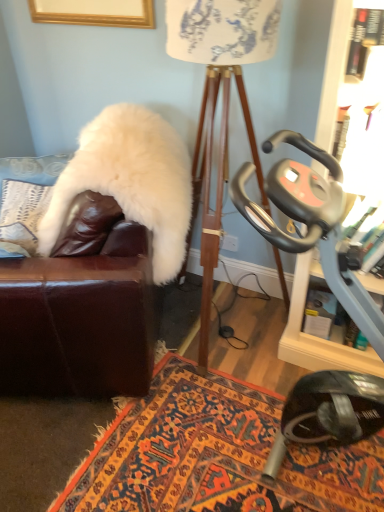
Question: Does white fluffy pillow at upper left come in front of white fabric lampshade at center?

Choices:
 (A) no
 (B) yes

Answer: (A)

Question: Is white fluffy pillow at upper left thinner than white fabric lampshade at center?

Choices:
 (A) yes
 (B) no

Answer: (A)

Question: Considering the relative sizes of white fluffy pillow at upper left and white fabric lampshade at center in the image provided, is white fluffy pillow at upper left wider than white fabric lampshade at center?

Choices:
 (A) no
 (B) yes

Answer: (A)

Question: Considering the relative sizes of white fluffy pillow at upper left and white fabric lampshade at center in the image provided, is white fluffy pillow at upper left bigger than white fabric lampshade at center?

Choices:
 (A) yes
 (B) no

Answer: (B)

Question: Is white fluffy pillow at upper left turned away from white fabric lampshade at center?

Choices:
 (A) no
 (B) yes

Answer: (A)

Question: Is white fluffy pillow at upper left oriented towards white fabric lampshade at center?

Choices:
 (A) no
 (B) yes

Answer: (A)

Question: Is white fluffy fur coat at left bigger than metallic gray stationary bike at right?

Choices:
 (A) yes
 (B) no

Answer: (B)

Question: Is white fluffy fur coat at left smaller than metallic gray stationary bike at right?

Choices:
 (A) yes
 (B) no

Answer: (A)

Question: Is metallic gray stationary bike at right surrounded by white fluffy fur coat at left?

Choices:
 (A) yes
 (B) no

Answer: (B)

Question: From a real-world perspective, is white fluffy fur coat at left on metallic gray stationary bike at right?

Choices:
 (A) yes
 (B) no

Answer: (A)

Question: Is white fluffy fur coat at left positioned far away from metallic gray stationary bike at right?

Choices:
 (A) no
 (B) yes

Answer: (A)

Question: Is white fluffy fur coat at left oriented towards metallic gray stationary bike at right?

Choices:
 (A) no
 (B) yes

Answer: (A)

Question: Is carpeted rug at center oriented towards white fluffy fur coat at left?

Choices:
 (A) yes
 (B) no

Answer: (B)